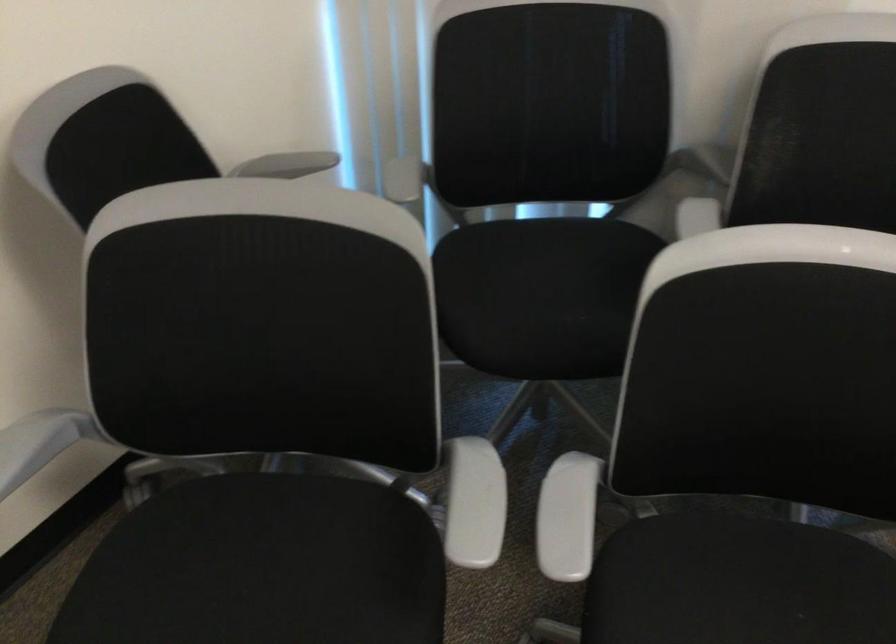
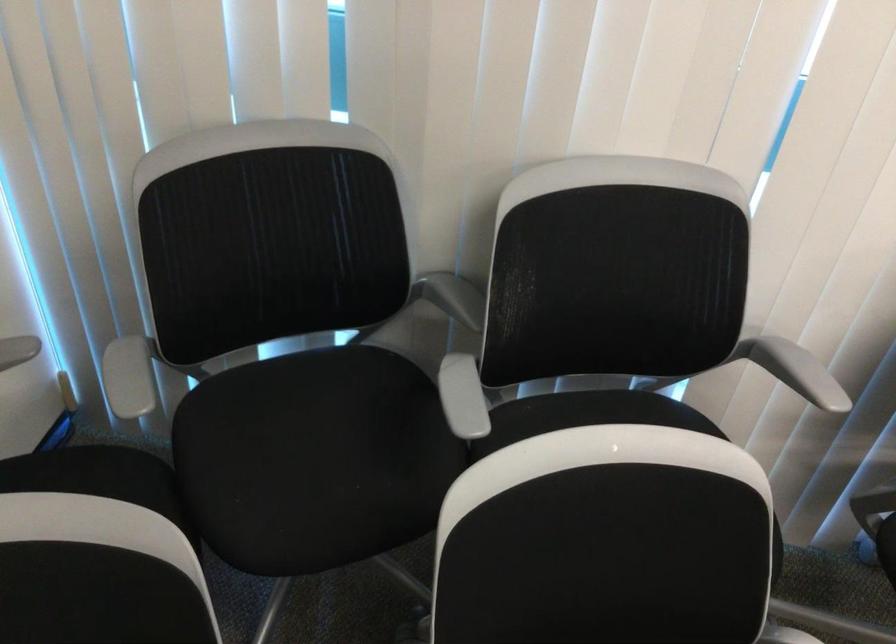
Find the pixel in the second image that matches pixel 546 279 in the first image.

(312, 442)